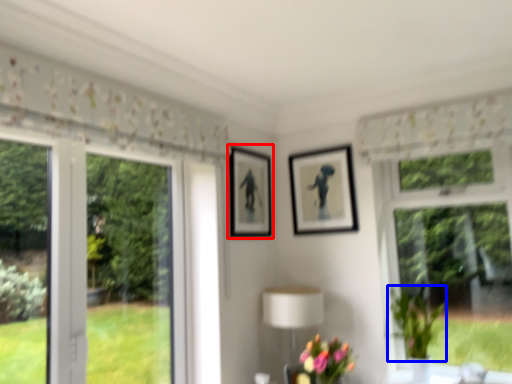
Question: Which object appears closest to the camera in this image, picture frame (highlighted by a red box) or plant (highlighted by a blue box)?

Choices:
 (A) picture frame
 (B) plant

Answer: (B)